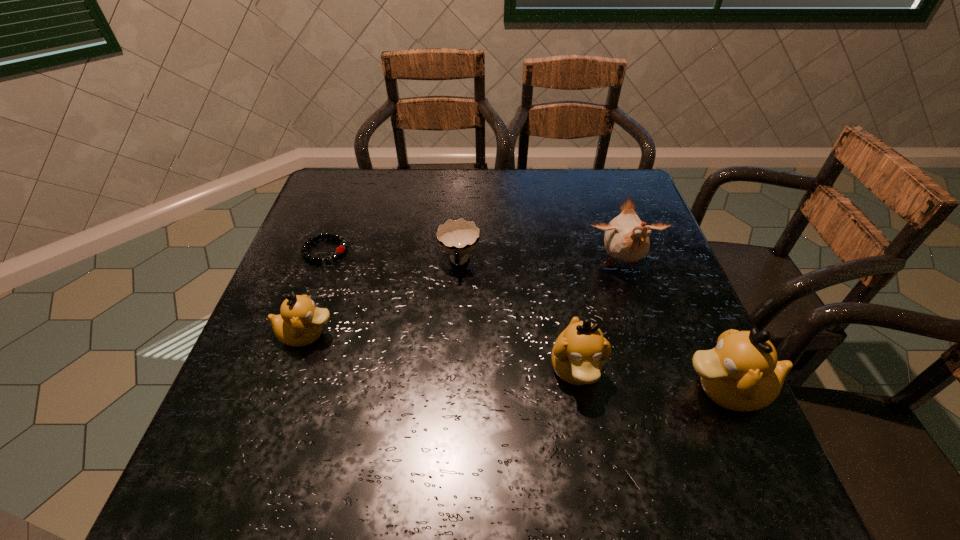
Locate an element on the screen. The width and height of the screenshot is (960, 540). duckling that is the nearest to the leftmost duckling is located at coordinates (578, 353).

This screenshot has height=540, width=960. I want to click on vacant space that satisfies the following two spatial constraints: 1. at the beak of the bird; 2. on the face of the leftmost duckling, so click(644, 335).

You are a GUI agent. You are given a task and a screenshot of the screen. Output one action in this format:
    pyautogui.click(x=<x>, y=<y>)
    Task: Click on the free space that satisfies the following two spatial constraints: 1. at the beak of the bird; 2. on the face of the shortest duckling
    
    Given the screenshot: What is the action you would take?
    644,335

Identify the location of vacant space that satisfies the following two spatial constraints: 1. at the beak of the bird; 2. on the face of the shortest duckling. (644, 335).